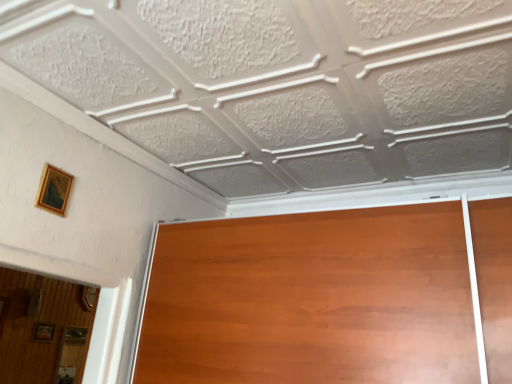
How much space does gold wooden picture frame at upper left, the 2th picture frame when ordered from back to front, occupy horizontally?

1.00 centimeters.

Measure the distance between point (66, 187) and camera.

The distance of point (66, 187) from camera is 1.53 meters.

This screenshot has height=384, width=512. I want to click on gold wooden picture frame at upper left, which appears as the first picture frame when viewed from the top, so click(54, 190).

What do you see at coordinates (54, 190) in the screenshot? This screenshot has width=512, height=384. I see `gold wooden picture frame at upper left, the second picture frame when ordered from bottom to top` at bounding box center [54, 190].

At what (x,y) coordinates should I click in order to perform the action: click on wooden picture frame at lower left, marked as the 2th picture frame in a right-to-left arrangement. Please return your answer as a coordinate pair (x, y). The width and height of the screenshot is (512, 384). Looking at the image, I should click on (44, 332).

The width and height of the screenshot is (512, 384). Describe the element at coordinates (44, 332) in the screenshot. I see `wooden picture frame at lower left, the 1th picture frame when ordered from left to right` at that location.

Identify the location of gold wooden picture frame at upper left, placed as the first picture frame when sorted from right to left. The width and height of the screenshot is (512, 384). (54, 190).

Between gold wooden picture frame at upper left, marked as the 1th picture frame in a front-to-back arrangement, and wooden picture frame at lower left, which is the first picture frame in bottom-to-top order, which one appears on the right side from the viewer's perspective?

Positioned to the right is gold wooden picture frame at upper left, marked as the 1th picture frame in a front-to-back arrangement.

In the image, is gold wooden picture frame at upper left, the second picture frame when ordered from bottom to top, positioned in front of or behind wooden picture frame at lower left, marked as the 2th picture frame in a right-to-left arrangement?

Clearly, gold wooden picture frame at upper left, the second picture frame when ordered from bottom to top, is in front of wooden picture frame at lower left, marked as the 2th picture frame in a right-to-left arrangement.

Is point (55, 180) behind point (52, 333)?

No, (55, 180) is in front of (52, 333).

From the image's perspective, is gold wooden picture frame at upper left, marked as the second picture frame in a left-to-right arrangement, located above wooden picture frame at lower left, the 2th picture frame in the front-to-back sequence?

Yes.

Looking at this image, from a real-world perspective, relative to wooden picture frame at lower left, marked as the 2th picture frame in a right-to-left arrangement, is gold wooden picture frame at upper left, marked as the 1th picture frame in a front-to-back arrangement, vertically above or below?

Clearly, from a real-world perspective, gold wooden picture frame at upper left, marked as the 1th picture frame in a front-to-back arrangement, is above wooden picture frame at lower left, marked as the 2th picture frame in a right-to-left arrangement.

Does gold wooden picture frame at upper left, marked as the second picture frame in a left-to-right arrangement, have a greater width compared to wooden picture frame at lower left, the first picture frame positioned from the back?

In fact, gold wooden picture frame at upper left, marked as the second picture frame in a left-to-right arrangement, might be narrower than wooden picture frame at lower left, the first picture frame positioned from the back.

In terms of height, does gold wooden picture frame at upper left, placed as the first picture frame when sorted from right to left, look taller or shorter compared to wooden picture frame at lower left, the 1th picture frame when ordered from left to right?

Clearly, gold wooden picture frame at upper left, placed as the first picture frame when sorted from right to left, is taller compared to wooden picture frame at lower left, the 1th picture frame when ordered from left to right.

Is gold wooden picture frame at upper left, marked as the second picture frame in a left-to-right arrangement, bigger or smaller than wooden picture frame at lower left, which is the first picture frame in bottom-to-top order?

gold wooden picture frame at upper left, marked as the second picture frame in a left-to-right arrangement, is smaller than wooden picture frame at lower left, which is the first picture frame in bottom-to-top order.

Is gold wooden picture frame at upper left, placed as the first picture frame when sorted from right to left, located outside wooden picture frame at lower left, marked as the 2th picture frame in a right-to-left arrangement?

Yes, gold wooden picture frame at upper left, placed as the first picture frame when sorted from right to left, is located beyond the bounds of wooden picture frame at lower left, marked as the 2th picture frame in a right-to-left arrangement.

Is gold wooden picture frame at upper left, the second picture frame when ordered from bottom to top, in contact with wooden picture frame at lower left, marked as the 2th picture frame in a right-to-left arrangement?

gold wooden picture frame at upper left, the second picture frame when ordered from bottom to top, is not next to wooden picture frame at lower left, marked as the 2th picture frame in a right-to-left arrangement, and they're not touching.

Could you tell me if gold wooden picture frame at upper left, the 2th picture frame when ordered from back to front, is turned towards wooden picture frame at lower left, the 2th picture frame in the front-to-back sequence?

No, gold wooden picture frame at upper left, the 2th picture frame when ordered from back to front, does not turn towards wooden picture frame at lower left, the 2th picture frame in the front-to-back sequence.

How many degrees apart are the facing directions of gold wooden picture frame at upper left, which appears as the first picture frame when viewed from the top, and wooden picture frame at lower left, placed as the 2th picture frame when sorted from top to bottom?

The angular difference between gold wooden picture frame at upper left, which appears as the first picture frame when viewed from the top, and wooden picture frame at lower left, placed as the 2th picture frame when sorted from top to bottom, is 0.507 degrees.

The height and width of the screenshot is (384, 512). I want to click on picture frame above the wooden picture frame at lower left, which is the first picture frame in bottom-to-top order (from a real-world perspective), so click(x=54, y=190).

Based on the photo, considering the positions of objects wooden picture frame at lower left, marked as the 2th picture frame in a right-to-left arrangement, and gold wooden picture frame at upper left, the 2th picture frame when ordered from back to front, in the image provided, who is more to the right, wooden picture frame at lower left, marked as the 2th picture frame in a right-to-left arrangement, or gold wooden picture frame at upper left, the 2th picture frame when ordered from back to front,?

Positioned to the right is gold wooden picture frame at upper left, the 2th picture frame when ordered from back to front.

Is wooden picture frame at lower left, marked as the 2th picture frame in a right-to-left arrangement, further to the viewer compared to gold wooden picture frame at upper left, placed as the first picture frame when sorted from right to left?

That is True.

Does point (36, 337) appear closer or farther from the camera than point (60, 181)?

Point (36, 337) is farther from the camera than point (60, 181).

From the image's perspective, which one is positioned higher, wooden picture frame at lower left, marked as the 2th picture frame in a right-to-left arrangement, or gold wooden picture frame at upper left, which appears as the first picture frame when viewed from the top?

gold wooden picture frame at upper left, which appears as the first picture frame when viewed from the top.

From a real-world perspective, who is located higher, wooden picture frame at lower left, placed as the 2th picture frame when sorted from top to bottom, or gold wooden picture frame at upper left, the 2th picture frame when ordered from back to front?

gold wooden picture frame at upper left, the 2th picture frame when ordered from back to front, from a real-world perspective.

Considering the sizes of wooden picture frame at lower left, the 2th picture frame in the front-to-back sequence, and gold wooden picture frame at upper left, marked as the second picture frame in a left-to-right arrangement, in the image, is wooden picture frame at lower left, the 2th picture frame in the front-to-back sequence, wider or thinner than gold wooden picture frame at upper left, marked as the second picture frame in a left-to-right arrangement,?

Considering their sizes, wooden picture frame at lower left, the 2th picture frame in the front-to-back sequence, looks broader than gold wooden picture frame at upper left, marked as the second picture frame in a left-to-right arrangement.

Between wooden picture frame at lower left, the 1th picture frame when ordered from left to right, and gold wooden picture frame at upper left, the second picture frame when ordered from bottom to top, which one has less height?

With less height is wooden picture frame at lower left, the 1th picture frame when ordered from left to right.

Does wooden picture frame at lower left, marked as the 2th picture frame in a right-to-left arrangement, have a larger size compared to gold wooden picture frame at upper left, the second picture frame when ordered from bottom to top?

Indeed, wooden picture frame at lower left, marked as the 2th picture frame in a right-to-left arrangement, has a larger size compared to gold wooden picture frame at upper left, the second picture frame when ordered from bottom to top.

Would you say wooden picture frame at lower left, the 1th picture frame when ordered from left to right, is outside gold wooden picture frame at upper left, the second picture frame when ordered from bottom to top?

Absolutely, wooden picture frame at lower left, the 1th picture frame when ordered from left to right, is external to gold wooden picture frame at upper left, the second picture frame when ordered from bottom to top.

Is wooden picture frame at lower left, which is the first picture frame in bottom-to-top order, with gold wooden picture frame at upper left, placed as the first picture frame when sorted from right to left?

No, wooden picture frame at lower left, which is the first picture frame in bottom-to-top order, is not beside gold wooden picture frame at upper left, placed as the first picture frame when sorted from right to left.

Is wooden picture frame at lower left, which is the first picture frame in bottom-to-top order, oriented away from gold wooden picture frame at upper left, marked as the 1th picture frame in a front-to-back arrangement?

wooden picture frame at lower left, which is the first picture frame in bottom-to-top order, does not have its back to gold wooden picture frame at upper left, marked as the 1th picture frame in a front-to-back arrangement.

Find the location of a particular element. picture frame that appears below the gold wooden picture frame at upper left, marked as the 1th picture frame in a front-to-back arrangement (from a real-world perspective) is located at coordinates (44, 332).

You are a GUI agent. You are given a task and a screenshot of the screen. Output one action in this format:
    pyautogui.click(x=<x>, y=<y>)
    Task: Click on the picture frame to the left of gold wooden picture frame at upper left, the second picture frame when ordered from bottom to top
    Image resolution: width=512 pixels, height=384 pixels.
    Given the screenshot: What is the action you would take?
    pyautogui.click(x=44, y=332)

The height and width of the screenshot is (384, 512). I want to click on picture frame that is above the wooden picture frame at lower left, the first picture frame positioned from the back (from the image's perspective), so 54,190.